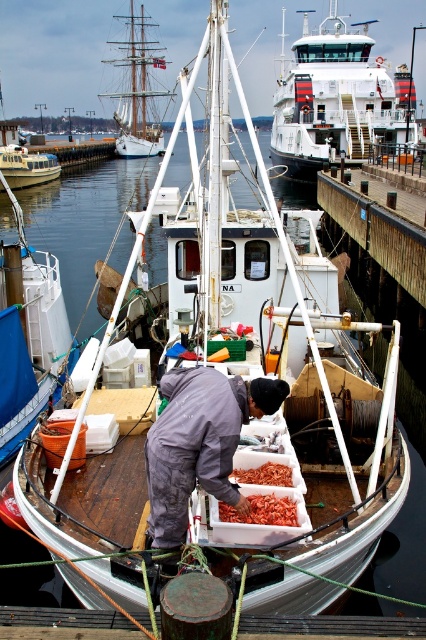
Is white plastic boat at center wider than white wooden boat at center?

Incorrect, white plastic boat at center's width does not surpass white wooden boat at center's.

Between point (0, 429) and point (9, 141), which one is positioned in front?

Point (0, 429) is in front.

Does point (69, 333) lie behind point (8, 164)?

That is False.

Where is `white plastic boat at center`? white plastic boat at center is located at coordinates (34, 332).

Between white glossy ferry at center and white wooden boat at center, which one has more height?

white wooden boat at center

Which is more to the left, white glossy ferry at center or white wooden boat at center?

white wooden boat at center

Does point (394, 97) lie in front of point (5, 138)?

That is True.

The image size is (426, 640). Identify the location of white glossy ferry at center. (339, 100).

Is point (344, 52) positioned after point (276, 465)?

That is True.

What do you see at coordinates (339, 100) in the screenshot?
I see `white glossy ferry at center` at bounding box center [339, 100].

You are a GUI agent. You are given a task and a screenshot of the screen. Output one action in this format:
    pyautogui.click(x=<x>, y=<y>)
    Task: Click on the white glossy ferry at center
    
    Given the screenshot: What is the action you would take?
    pyautogui.click(x=339, y=100)

In order to click on white glossy ferry at center in this screenshot , I will do `click(339, 100)`.